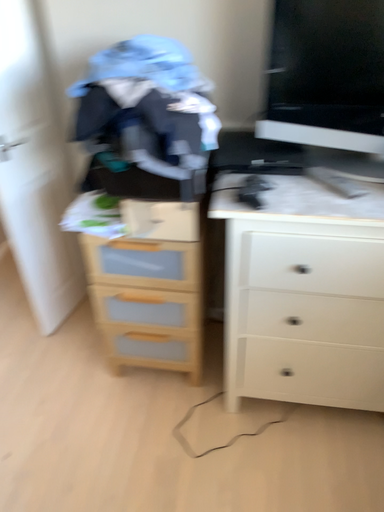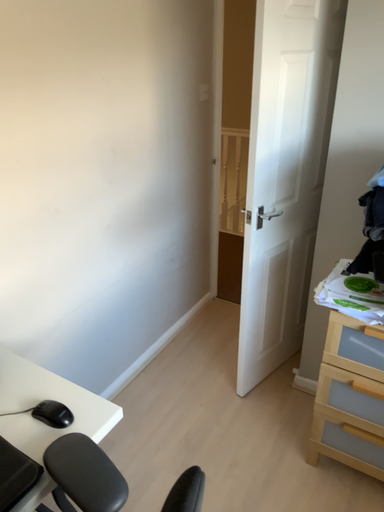
Question: Which way did the camera rotate in the video?

Choices:
 (A) rotated upward
 (B) rotated downward

Answer: (A)